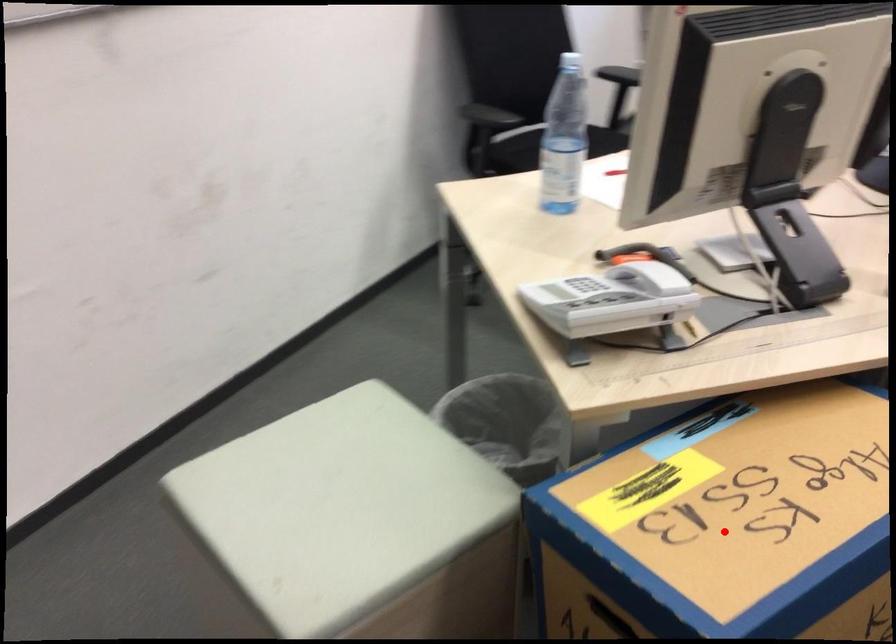
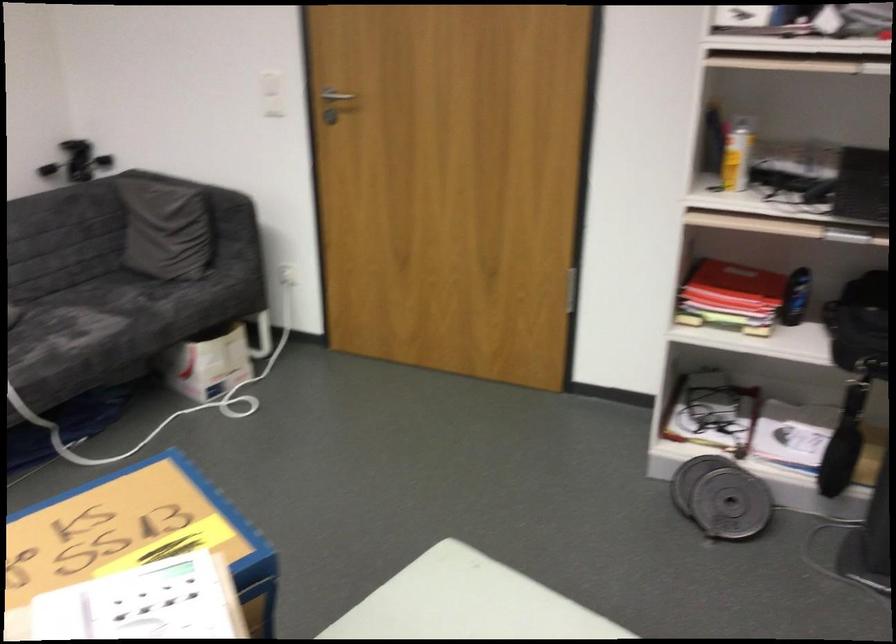
Find the pixel in the second image that matches the highlighted location in the first image.

(139, 535)